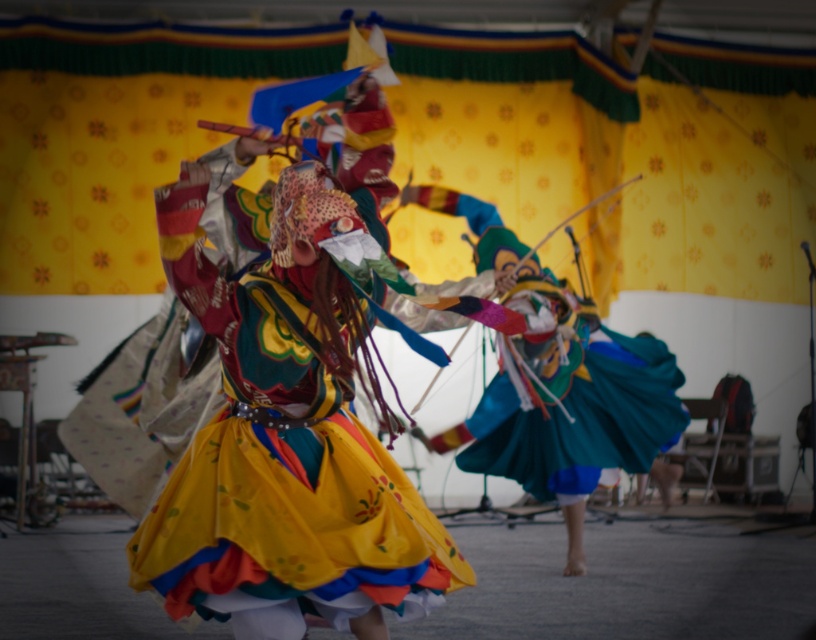
Is the position of multicolored fabric costume at center more distant than that of teal satin skirt at center?

No.

Which is in front, point (240, 291) or point (575, 301)?

Point (240, 291) is more forward.

Where is `multicolored fabric costume at center`? multicolored fabric costume at center is located at coordinates (284, 440).